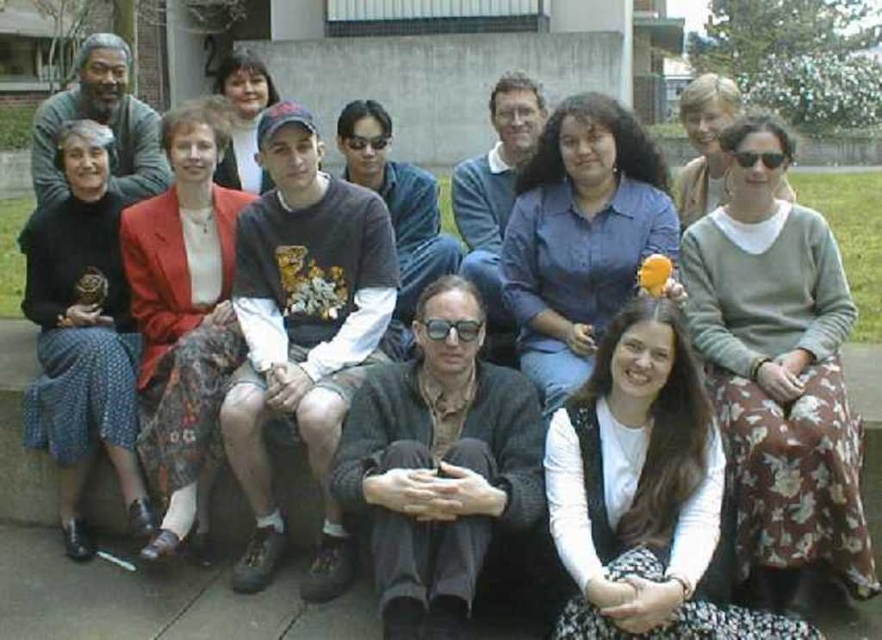
Question: Does black matte sweater at center appear under dark gray sweater at center?

Choices:
 (A) no
 (B) yes

Answer: (B)

Question: Which point is closer to the camera?

Choices:
 (A) blue shirt at center
 (B) black matte sweater at center

Answer: (B)

Question: Which is nearer to the matte gray sweater at left?

Choices:
 (A) matte black jacket at upper center
 (B) white lace dress at lower right
 (C) blue shirt at center

Answer: (A)

Question: Estimate the real-world distances between objects in this image. Which object is closer to the matte gray sweater at left?

Choices:
 (A) matte red blazer at center
 (B) black matte sweater at center
 (C) light gray sweater at center

Answer: (A)

Question: Does matte red blazer at center appear under matte gray sweater at left?

Choices:
 (A) yes
 (B) no

Answer: (A)

Question: Is black matte sweater at center thinner than matte gray sweater at left?

Choices:
 (A) no
 (B) yes

Answer: (B)